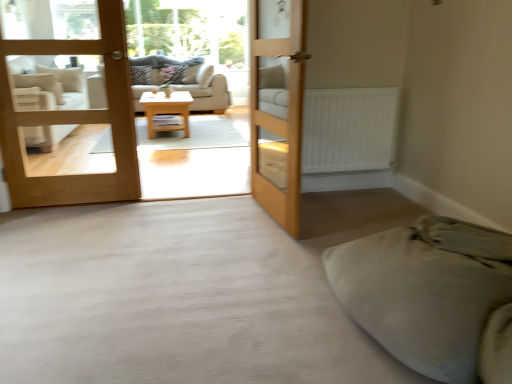
Question: Is transparent glass window screen at upper center facing towards light brown wood door at left, the 2th door when ordered from right to left?

Choices:
 (A) no
 (B) yes

Answer: (B)

Question: Would you consider transparent glass window screen at upper center to be distant from light brown wood door at left, the first door from the left?

Choices:
 (A) no
 (B) yes

Answer: (B)

Question: Is transparent glass window screen at upper center at the left side of light brown wood door at left, the 2th door when ordered from right to left?

Choices:
 (A) no
 (B) yes

Answer: (B)

Question: Is transparent glass window screen at upper center oriented away from light brown wood door at left, the 2th door when ordered from right to left?

Choices:
 (A) yes
 (B) no

Answer: (B)

Question: Can you confirm if transparent glass window screen at upper center is positioned to the right of light brown wood door at left, the first door from the left?

Choices:
 (A) yes
 (B) no

Answer: (B)

Question: Considering the relative sizes of transparent glass window screen at upper center and light brown wood door at left, the first door from the left, in the image provided, is transparent glass window screen at upper center wider than light brown wood door at left, the first door from the left,?

Choices:
 (A) no
 (B) yes

Answer: (B)

Question: Can you confirm if patterned fabric pillow at center, the second pillow in the right-to-left sequence, is thinner than beige fabric couch at center?

Choices:
 (A) no
 (B) yes

Answer: (B)

Question: Is patterned fabric pillow at center, the first pillow in the left-to-right sequence, at the left side of beige fabric couch at center?

Choices:
 (A) yes
 (B) no

Answer: (A)

Question: Is patterned fabric pillow at center, the first pillow in the left-to-right sequence, aimed at beige fabric couch at center?

Choices:
 (A) no
 (B) yes

Answer: (B)

Question: From the image's perspective, is patterned fabric pillow at center, the first pillow in the left-to-right sequence, located above beige fabric couch at center?

Choices:
 (A) no
 (B) yes

Answer: (B)

Question: Can you confirm if patterned fabric pillow at center, the second pillow in the right-to-left sequence, is bigger than beige fabric couch at center?

Choices:
 (A) no
 (B) yes

Answer: (A)

Question: From a real-world perspective, is patterned fabric pillow at center, the second pillow in the right-to-left sequence, over beige fabric couch at center?

Choices:
 (A) yes
 (B) no

Answer: (A)

Question: Considering the relative sizes of light brown wood door at left, the first door from the left, and patterned fabric pillow at center, the first pillow in the left-to-right sequence, in the image provided, is light brown wood door at left, the first door from the left, wider than patterned fabric pillow at center, the first pillow in the left-to-right sequence,?

Choices:
 (A) yes
 (B) no

Answer: (B)